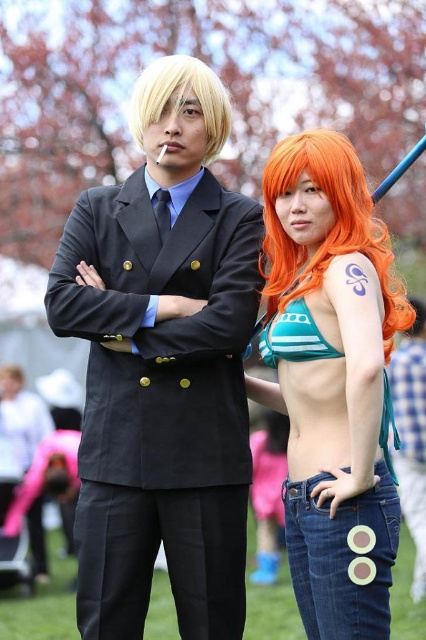
You are a photographer setting up for a photoshoot. You need to position a large reflector to the left of the orange synthetic wig at right and a small reflector to the right of the blonde synthetic wig at center. Which reflector should be placed closer to the camera?

The orange synthetic wig at right is larger in size than the blonde synthetic wig at center, so the large reflector should be placed closer to the camera to properly illuminate the larger wig.

You are a photographer setting up a shoot for a magazine. You need to position a matte black suit at center and an orange synthetic wig at right in a way that the taller object is placed in the foreground to create a visual contrast. Based on the scene description, which object should be placed in the foreground?

The matte black suit at center is taller than the orange synthetic wig at right, so the matte black suit at center should be placed in the foreground to create the desired visual contrast.